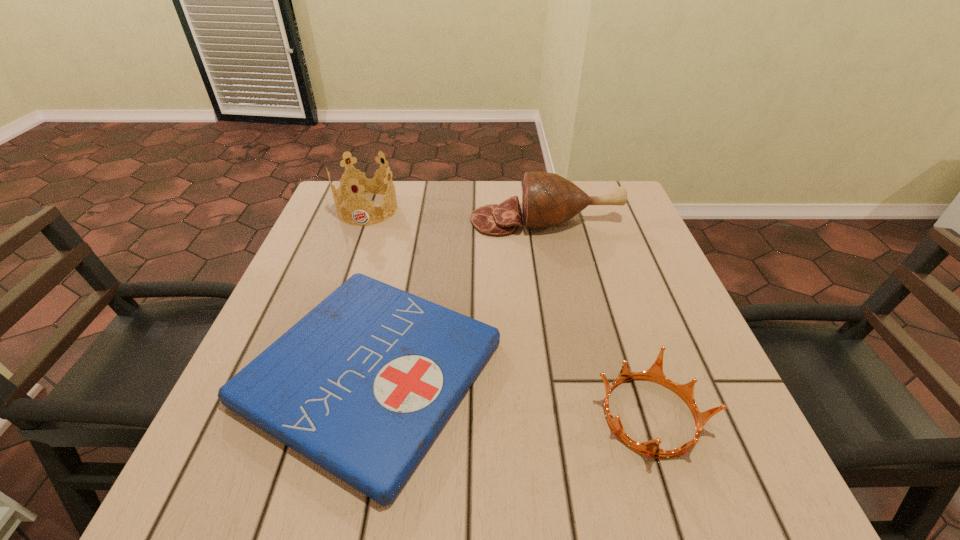
I want to click on vacant point located on the back of the third tallest object, so click(596, 249).

This screenshot has height=540, width=960. I want to click on free location located on the back of the shortest object, so click(x=407, y=213).

This screenshot has height=540, width=960. Find the location of `crown that is at the far edge`. crown that is at the far edge is located at coordinates (361, 180).

In order to click on ham at the far edge in this screenshot , I will do (x=548, y=199).

Identify the location of crown that is positioned at the near edge. The width and height of the screenshot is (960, 540). (651, 448).

At what (x,y) coordinates should I click in order to perform the action: click on the first-aid kit positioned at the near edge. Please return your answer as a coordinate pair (x, y). This screenshot has width=960, height=540. Looking at the image, I should click on (362, 385).

Where is `crown located at the left edge`? The height and width of the screenshot is (540, 960). crown located at the left edge is located at coordinates (361, 180).

Locate an element on the screen. This screenshot has height=540, width=960. the first-aid kit situated at the left edge is located at coordinates (362, 385).

Where is `ham that is at the right edge`? ham that is at the right edge is located at coordinates (548, 199).

Find the location of a particular element. The image size is (960, 540). crown present at the right edge is located at coordinates (651, 448).